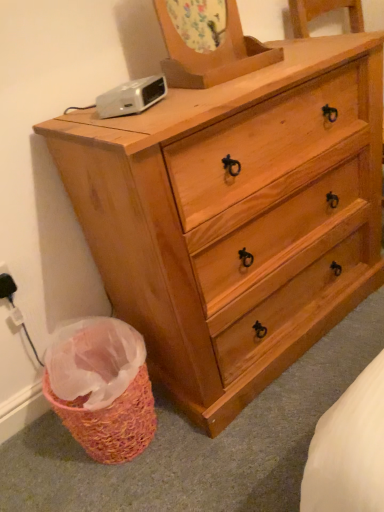
Question: From a real-world perspective, is natural wood dresser at center located higher than black plastic electric outlet at lower left?

Choices:
 (A) yes
 (B) no

Answer: (B)

Question: Could you tell me if natural wood dresser at center is facing black plastic electric outlet at lower left?

Choices:
 (A) no
 (B) yes

Answer: (A)

Question: From the image's perspective, does natural wood dresser at center appear lower than black plastic electric outlet at lower left?

Choices:
 (A) no
 (B) yes

Answer: (A)

Question: Is natural wood dresser at center shorter than black plastic electric outlet at lower left?

Choices:
 (A) yes
 (B) no

Answer: (B)

Question: Is natural wood dresser at center smaller than black plastic electric outlet at lower left?

Choices:
 (A) no
 (B) yes

Answer: (A)

Question: Does natural wood dresser at center touch black plastic electric outlet at lower left?

Choices:
 (A) no
 (B) yes

Answer: (A)

Question: From the image's perspective, is black plastic electric outlet at lower left located above white plastic clock at upper left?

Choices:
 (A) no
 (B) yes

Answer: (A)

Question: Could you tell me if black plastic electric outlet at lower left is turned towards white plastic clock at upper left?

Choices:
 (A) yes
 (B) no

Answer: (B)

Question: Considering the relative sizes of black plastic electric outlet at lower left and white plastic clock at upper left in the image provided, is black plastic electric outlet at lower left shorter than white plastic clock at upper left?

Choices:
 (A) yes
 (B) no

Answer: (B)

Question: Is black plastic electric outlet at lower left next to white plastic clock at upper left?

Choices:
 (A) no
 (B) yes

Answer: (A)

Question: Is black plastic electric outlet at lower left far away from white plastic clock at upper left?

Choices:
 (A) no
 (B) yes

Answer: (A)

Question: Is black plastic electric outlet at lower left looking in the opposite direction of white plastic clock at upper left?

Choices:
 (A) yes
 (B) no

Answer: (B)

Question: Does black plastic electric outlet at lower left have a lesser width compared to natural wood dresser at center?

Choices:
 (A) no
 (B) yes

Answer: (B)